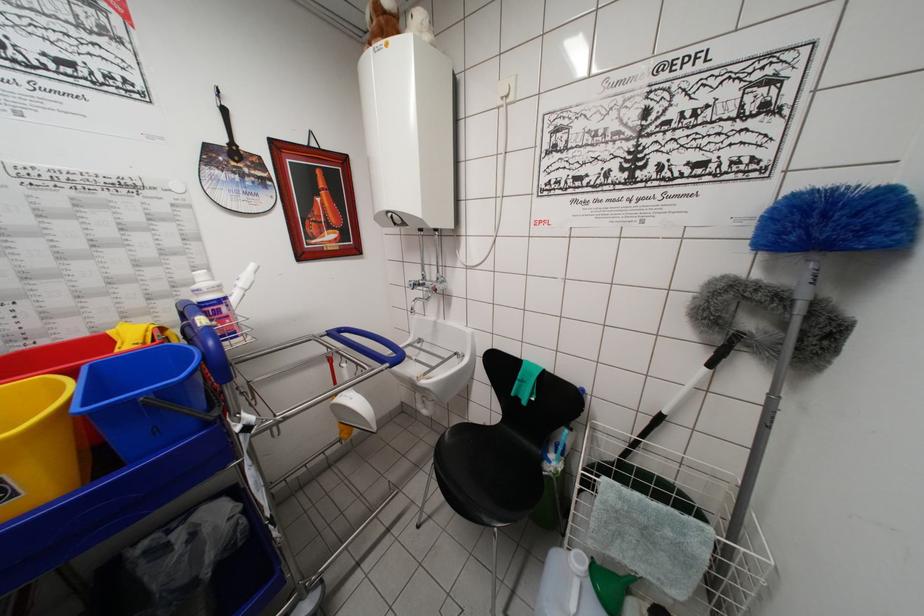
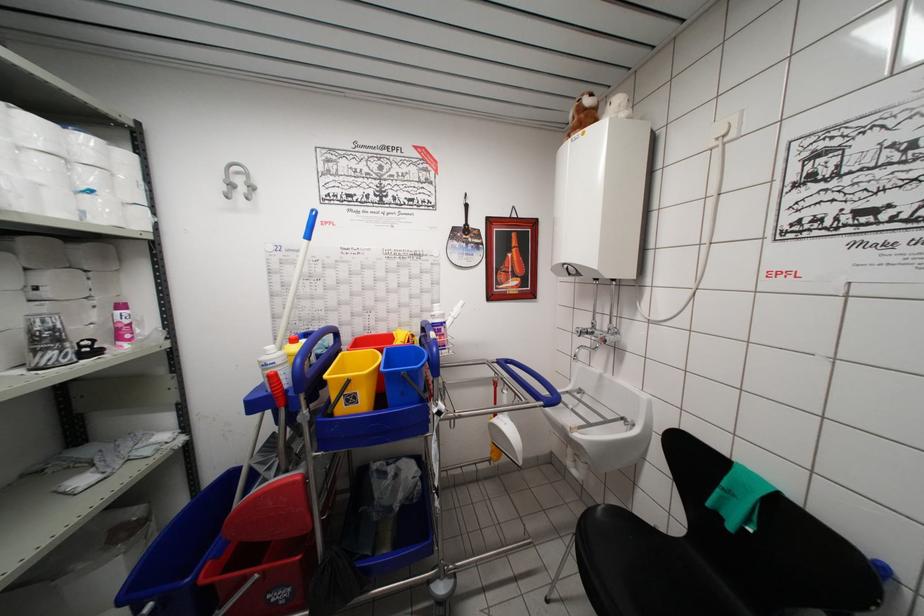
Question: The camera is either moving clockwise (left) or counter-clockwise (right) around the object. The first image is from the beginning of the video and the second image is from the end. Is the camera moving left or right when shooting the video?

Choices:
 (A) Left
 (B) Right

Answer: (B)